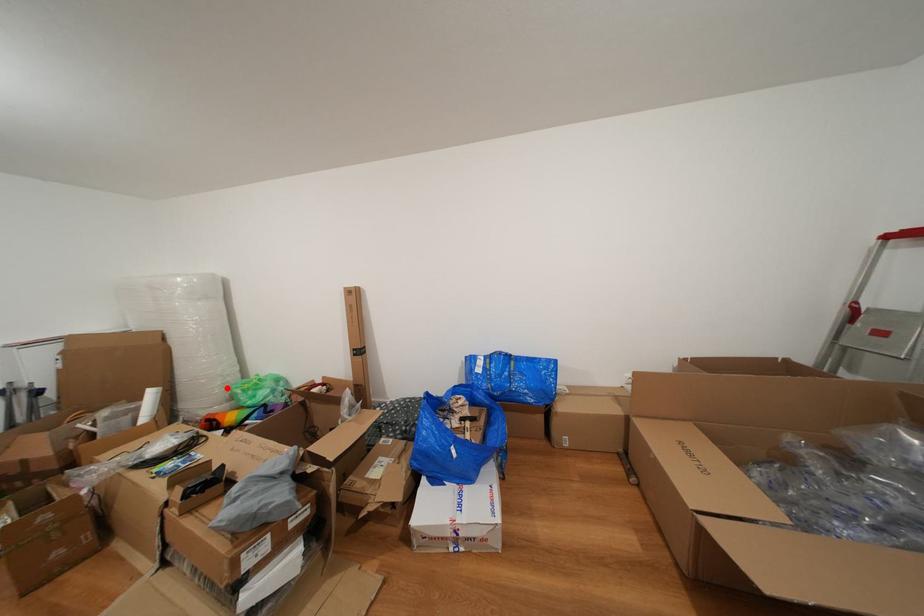
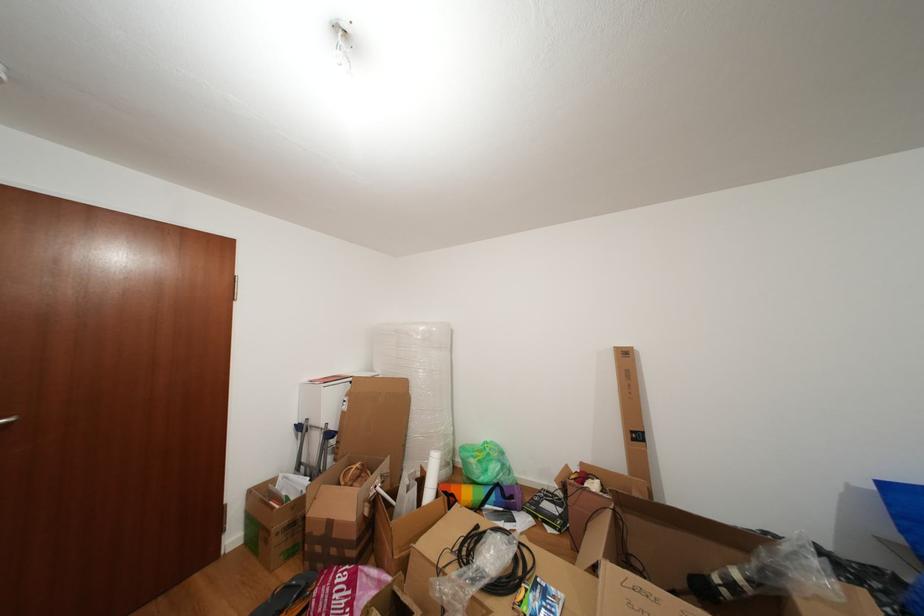
Where in the second image is the point corresponding to the highlighted location from the first image?

(450, 448)